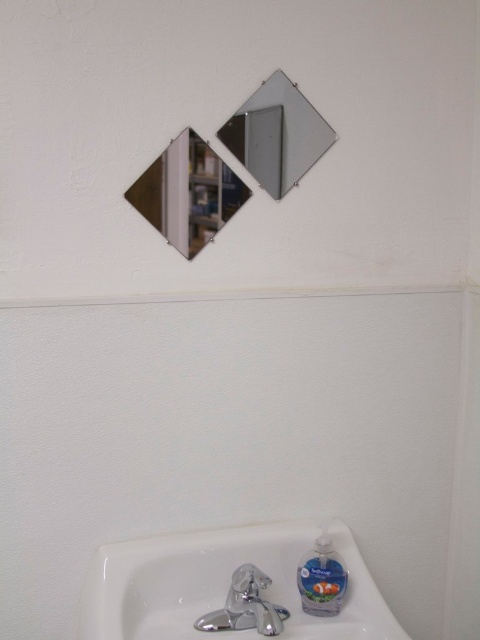
Does point (276, 621) come farther from viewer compared to point (307, 602)?

No, it is in front of (307, 602).

Does chrome metallic faucet at lower center have a lesser height compared to translucent plastic soap at lower right?

Yes, chrome metallic faucet at lower center is shorter than translucent plastic soap at lower right.

Is point (236, 592) more distant than point (334, 600)?

No, it is not.

Find the location of a particular element. The width and height of the screenshot is (480, 640). chrome metallic faucet at lower center is located at coordinates (245, 605).

Is white glossy sink at lower center shorter than translucent plastic soap at lower right?

No.

Which is in front, point (351, 605) or point (300, 589)?

Positioned in front is point (351, 605).

Which is in front, point (324, 636) or point (320, 538)?

Point (324, 636) is more forward.

In order to click on white glossy sink at lower center in this screenshot , I will do `click(223, 584)`.

Measure the distance from white glossy sink at lower center to chrome metallic faucet at lower center.

A distance of 3.06 inches exists between white glossy sink at lower center and chrome metallic faucet at lower center.

Between white glossy sink at lower center and chrome metallic faucet at lower center, which one is positioned lower?

chrome metallic faucet at lower center is lower down.

Is point (144, 544) positioned behind point (250, 604)?

Yes, point (144, 544) is farther from viewer.

Where is `white glossy sink at lower center`? white glossy sink at lower center is located at coordinates (223, 584).